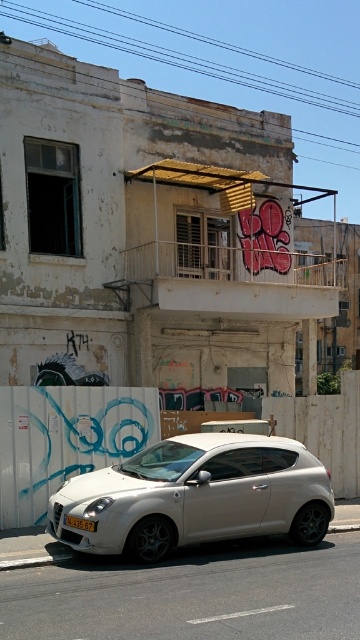
Which is above, white matte hatchback at center or yellow matte license plate at lower center?

Positioned higher is white matte hatchback at center.

Is white matte hatchback at center to the right of yellow matte license plate at lower center from the viewer's perspective?

Yes, white matte hatchback at center is to the right of yellow matte license plate at lower center.

Where is `white matte hatchback at center`? The height and width of the screenshot is (640, 360). white matte hatchback at center is located at coordinates (196, 497).

The height and width of the screenshot is (640, 360). Identify the location of white matte hatchback at center. (196, 497).